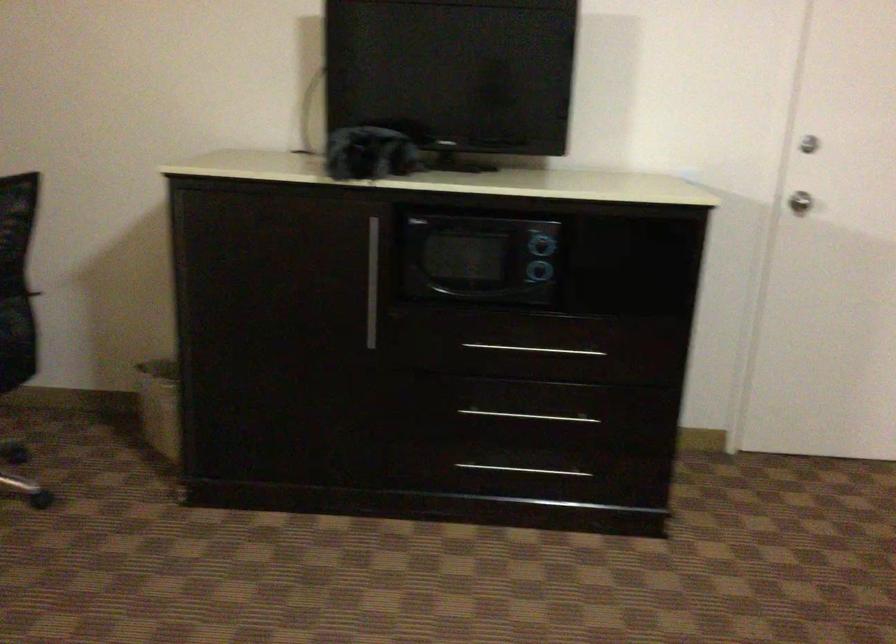
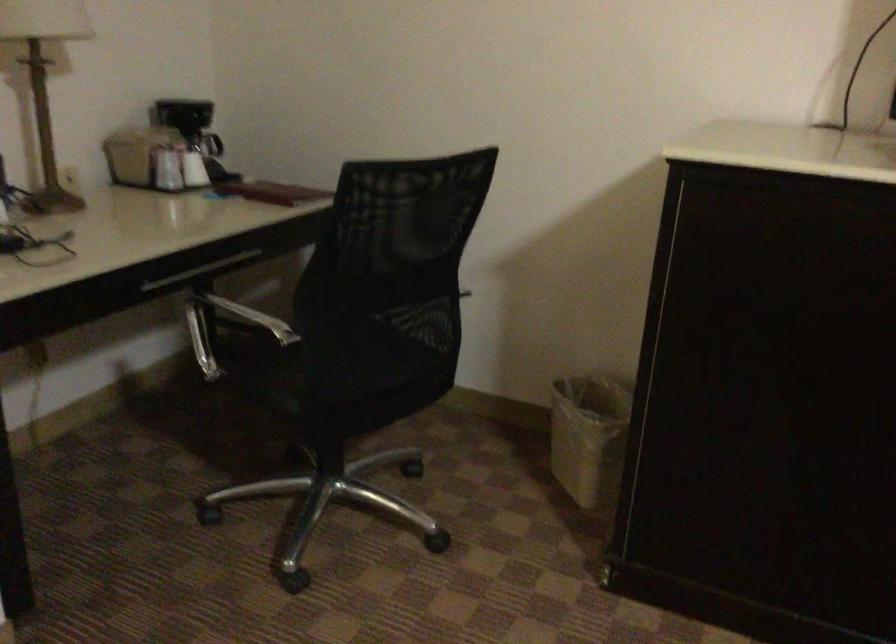
From the picture: The images are taken continuously from a first-person perspective. In which direction are you moving?

The movement direction of the cameraman is left, forward.